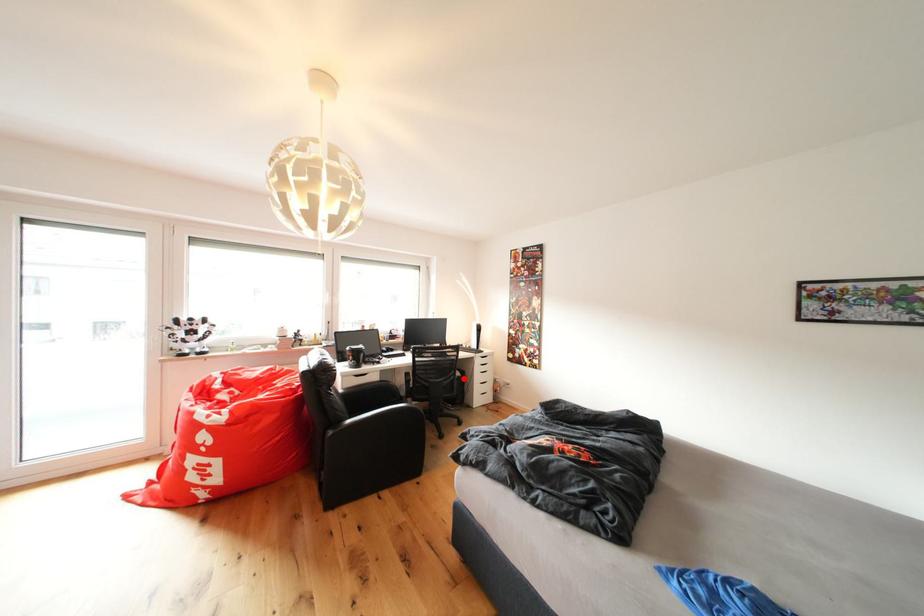
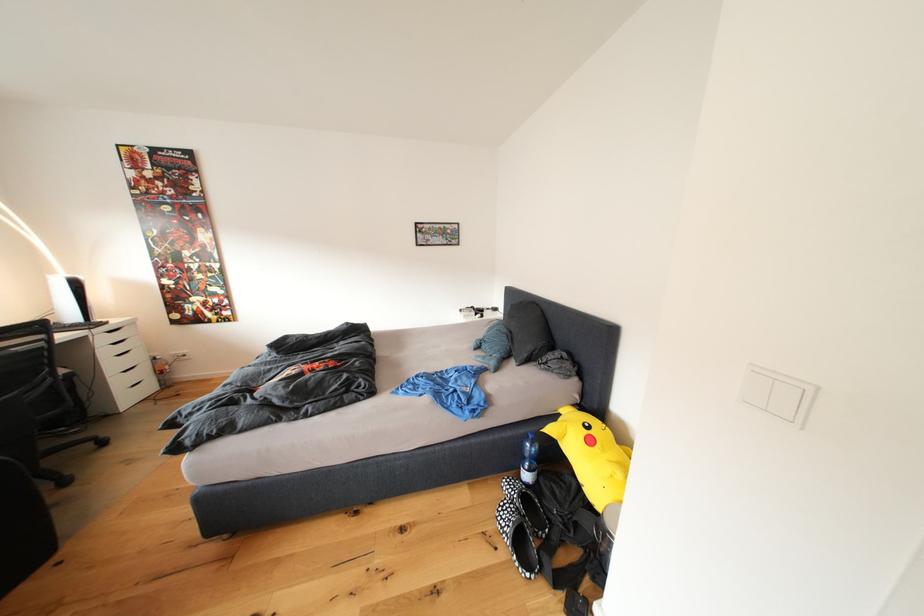
Question: A red point is marked in image1. In image2, is the corresponding 3D point closer to the camera or farther? Reply with the corresponding letter.

Choices:
 (A) The corresponding 3D point is closer.
 (B) The corresponding 3D point is farther.

Answer: (A)